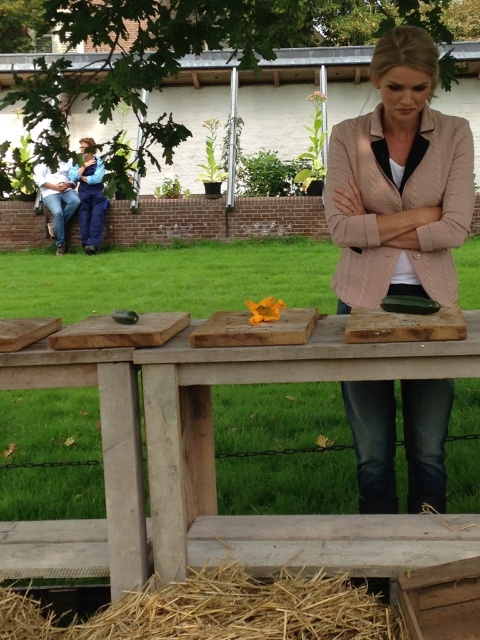
From the picture: Between golden straw at lower center and orange paper at center, which one has more height?

With more height is golden straw at lower center.

Between golden straw at lower center and orange paper at center, which one is positioned higher?

orange paper at center is higher up.

Who is more forward, (288,589) or (273,307)?

Point (288,589) is more forward.

The width and height of the screenshot is (480, 640). What are the coordinates of `golden straw at lower center` in the screenshot? It's located at (216, 611).

Which is more to the left, matte pink blazer at center or blue denim jacket at left?

blue denim jacket at left is more to the left.

Does matte pink blazer at center appear on the left side of blue denim jacket at left?

In fact, matte pink blazer at center is to the right of blue denim jacket at left.

Which is in front, point (375, 154) or point (81, 177)?

Point (375, 154) is in front.

The image size is (480, 640). I want to click on matte pink blazer at center, so click(x=399, y=182).

Does golden straw at lower center come behind blue denim jacket at left?

No.

Does golden straw at lower center appear on the left side of blue denim jacket at left?

In fact, golden straw at lower center is to the right of blue denim jacket at left.

Where is `golden straw at lower center`? The width and height of the screenshot is (480, 640). golden straw at lower center is located at coordinates (216, 611).